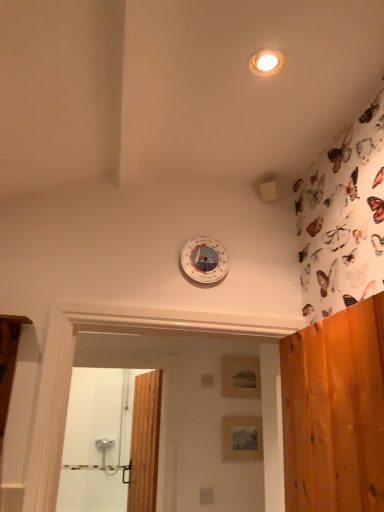
This screenshot has height=512, width=384. What do you see at coordinates (240, 377) in the screenshot?
I see `matte wooden panel at center, the 1th panel when ordered from top to bottom` at bounding box center [240, 377].

What is the approximate height of matte wooden panel at center, which is the 2th panel from bottom to top?

12.35 inches.

The width and height of the screenshot is (384, 512). Describe the element at coordinates (97, 439) in the screenshot. I see `wooden screen door at lower left` at that location.

What do you see at coordinates (145, 442) in the screenshot? I see `wooden door at center` at bounding box center [145, 442].

The width and height of the screenshot is (384, 512). In order to click on white plastic clock at upper center in this screenshot , I will do `click(204, 260)`.

Where is `matte wooden panel at center, the 1th panel when ordered from top to bottom`? The width and height of the screenshot is (384, 512). matte wooden panel at center, the 1th panel when ordered from top to bottom is located at coordinates (240, 377).

Based on the photo, from a real-world perspective, is matte white light fixture at upper center on matte wooden panel at center, the second panel from the top?

Yes, from a real-world perspective, matte white light fixture at upper center is on top of matte wooden panel at center, the second panel from the top.

Can you confirm if matte white light fixture at upper center is smaller than matte wooden panel at center, the second panel from the back?

Indeed, matte white light fixture at upper center has a smaller size compared to matte wooden panel at center, the second panel from the back.

Can you confirm if matte white light fixture at upper center is wider than matte wooden panel at center, the second panel from the top?

Yes.

Is matte white light fixture at upper center not near matte wooden panel at center, placed as the first panel when sorted from front to back?

That's right, there is a large distance between matte white light fixture at upper center and matte wooden panel at center, placed as the first panel when sorted from front to back.

Does matte wooden panel at center, the second panel from the back, have a lesser height compared to wooden door at center?

Yes, matte wooden panel at center, the second panel from the back, is shorter than wooden door at center.

Where is `door below the matte wooden panel at center, placed as the first panel when sorted from front to back (from the image's perspective)`? This screenshot has width=384, height=512. door below the matte wooden panel at center, placed as the first panel when sorted from front to back (from the image's perspective) is located at coordinates (145, 442).

From a real-world perspective, relative to wooden door at center, is matte wooden panel at center, the first panel when ordered from bottom to top, vertically above or below?

In terms of real-world spatial position, matte wooden panel at center, the first panel when ordered from bottom to top, is above wooden door at center.

Is point (129, 475) behind point (217, 261)?

Yes, it is.

Who is shorter, wooden door at center or white plastic clock at upper center?

white plastic clock at upper center.

Does wooden door at center have a larger size compared to white plastic clock at upper center?

Indeed, wooden door at center has a larger size compared to white plastic clock at upper center.

From the image's perspective, between wooden door at center and white plastic clock at upper center, who is located below?

wooden door at center.

Does wooden screen door at lower left have a lesser width compared to white plastic clock at upper center?

In fact, wooden screen door at lower left might be wider than white plastic clock at upper center.

Which object is positioned more to the left, wooden screen door at lower left or white plastic clock at upper center?

From the viewer's perspective, wooden screen door at lower left appears more on the left side.

Is wooden screen door at lower left situated inside white plastic clock at upper center or outside?

wooden screen door at lower left is not inside white plastic clock at upper center, it's outside.

Is wooden screen door at lower left shorter than white plastic clock at upper center?

No, wooden screen door at lower left is not shorter than white plastic clock at upper center.

Is white plastic clock at upper center positioned with its back to matte white light fixture at upper center?

No, white plastic clock at upper center's orientation is not away from matte white light fixture at upper center.

Considering the relative positions of white plastic clock at upper center and matte white light fixture at upper center in the image provided, is white plastic clock at upper center to the left or to the right of matte white light fixture at upper center?

white plastic clock at upper center is to the left of matte white light fixture at upper center.

How many degrees apart are the facing directions of white plastic clock at upper center and matte white light fixture at upper center?

They differ by 93 degrees in their facing directions.

Which point is more forward, [239,425] or [247,393]?

Point [239,425]

Is matte wooden panel at center, the second panel from the top, far from matte wooden panel at center, acting as the first panel starting from the back?

matte wooden panel at center, the second panel from the top, is near matte wooden panel at center, acting as the first panel starting from the back, not far away.

In the image, is matte wooden panel at center, the first panel when ordered from bottom to top, positioned in front of or behind matte wooden panel at center, which is the second panel from front to back?

In the image, matte wooden panel at center, the first panel when ordered from bottom to top, appears in front of matte wooden panel at center, which is the second panel from front to back.

Could you tell me if matte wooden panel at center, placed as the first panel when sorted from front to back, is turned towards matte wooden panel at center, which is the second panel from front to back?

No, matte wooden panel at center, placed as the first panel when sorted from front to back, is not oriented towards matte wooden panel at center, which is the second panel from front to back.

Considering the relative positions of matte white light fixture at upper center and wooden screen door at lower left in the image provided, is matte white light fixture at upper center to the right of wooden screen door at lower left from the viewer's perspective?

Correct, you'll find matte white light fixture at upper center to the right of wooden screen door at lower left.

Is matte white light fixture at upper center outside of wooden screen door at lower left?

matte white light fixture at upper center is positioned outside wooden screen door at lower left.

Is matte white light fixture at upper center thinner than wooden screen door at lower left?

Yes.

Consider the image. Considering the sizes of objects matte white light fixture at upper center and wooden screen door at lower left in the image provided, who is bigger, matte white light fixture at upper center or wooden screen door at lower left?

wooden screen door at lower left.

Identify the location of light fixture to the left of matte wooden panel at center, the second panel from the top. The image size is (384, 512). (266, 62).

Find the location of a particular element. The width and height of the screenshot is (384, 512). door in front of the matte wooden panel at center, placed as the first panel when sorted from front to back is located at coordinates (145, 442).

Based on their spatial positions, is white plastic clock at upper center or matte wooden panel at center, the second panel from the back, further from wooden screen door at lower left?

The object further to wooden screen door at lower left is white plastic clock at upper center.

From the image, which object appears to be nearer to matte wooden panel at center, which is the second panel from front to back, matte wooden panel at center, placed as the first panel when sorted from front to back, or wooden screen door at lower left?

matte wooden panel at center, placed as the first panel when sorted from front to back, is closer to matte wooden panel at center, which is the second panel from front to back.

Considering their positions, is matte white light fixture at upper center positioned further to wooden screen door at lower left than matte wooden panel at center, the first panel when ordered from bottom to top?

Based on the image, matte white light fixture at upper center appears to be further to wooden screen door at lower left.

Considering their positions, is white plastic clock at upper center positioned further to wooden door at center than matte wooden panel at center, which is the second panel from front to back?

Based on the image, white plastic clock at upper center appears to be further to wooden door at center.

Considering their positions, is matte wooden panel at center, the second panel from the top, positioned further to wooden screen door at lower left than white plastic clock at upper center?

Based on the image, white plastic clock at upper center appears to be further to wooden screen door at lower left.

Estimate the real-world distances between objects in this image. Which object is closer to matte white light fixture at upper center, matte wooden panel at center, placed as the first panel when sorted from front to back, or white plastic clock at upper center?

white plastic clock at upper center is closer to matte white light fixture at upper center.

Looking at the image, which one is located further to matte wooden panel at center, the second panel from the back, matte white light fixture at upper center or matte wooden panel at center, which is the second panel from front to back?

matte white light fixture at upper center is positioned further to the anchor matte wooden panel at center, the second panel from the back.

Based on their spatial positions, is wooden screen door at lower left or matte white light fixture at upper center closer to matte wooden panel at center, acting as the first panel starting from the back?

matte white light fixture at upper center is positioned closer to the anchor matte wooden panel at center, acting as the first panel starting from the back.

The image size is (384, 512). Find the location of `panel between matte white light fixture at upper center and matte wooden panel at center, acting as the first panel starting from the back, along the z-axis`. panel between matte white light fixture at upper center and matte wooden panel at center, acting as the first panel starting from the back, along the z-axis is located at coordinates (242, 438).

At what (x,y) coordinates should I click in order to perform the action: click on door located between wooden screen door at lower left and matte wooden panel at center, the second panel from the top, in the left-right direction. Please return your answer as a coordinate pair (x, y). The height and width of the screenshot is (512, 384). Looking at the image, I should click on (145, 442).

Locate an element on the screen. Image resolution: width=384 pixels, height=512 pixels. clock between matte white light fixture at upper center and wooden screen door at lower left from top to bottom is located at coordinates (204, 260).

The height and width of the screenshot is (512, 384). I want to click on screen door between matte white light fixture at upper center and matte wooden panel at center, acting as the first panel starting from the back, from front to back, so click(97, 439).